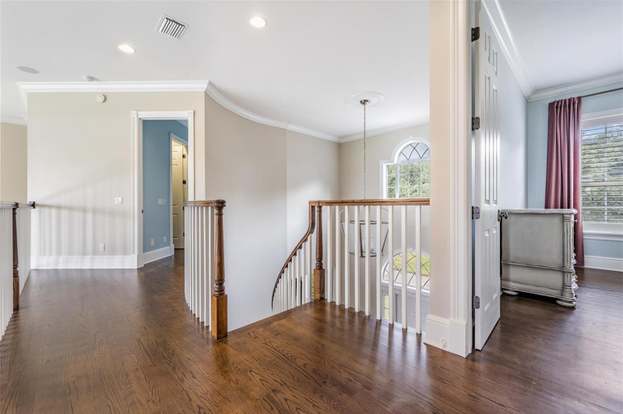
This screenshot has height=414, width=623. What are the coordinates of `stairway railing` in the screenshot? It's located at (282, 269), (345, 202).